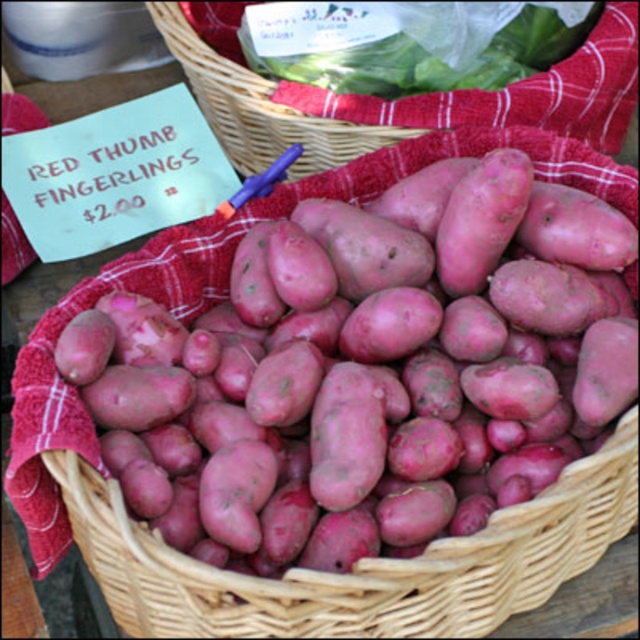
You are a customer at a farmers market and see the matte red potato at center and the matte wicker basket at center in the image. Which object is bigger in size?

The matte red potato at center is larger in size compared to the matte wicker basket at center.

Looking at the scene, where is the matte wicker basket at center in relation to the smooth green leafy vegetable at upper center?

The matte wicker basket at center is to the left of the smooth green leafy vegetable at upper center.

You are a customer at a farmers market and see the basket with matte red potato at center and smooth green leafy vegetable at upper center. If you want to buy the larger item, which one should you choose?

A: The matte red potato at center is larger in size than the smooth green leafy vegetable at upper center, so you should choose the matte red potato at center.